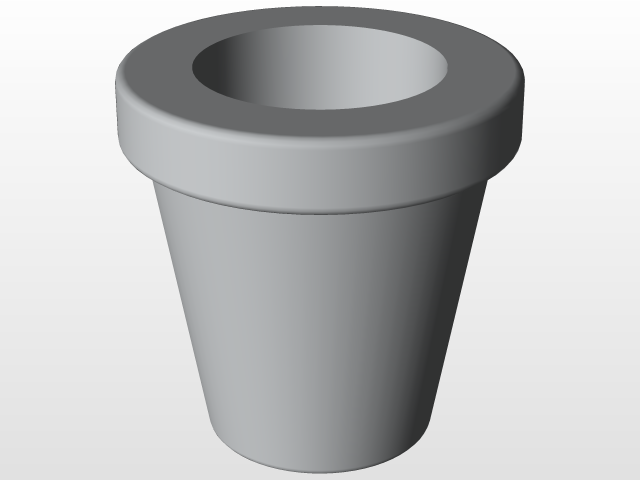
This screenshot has height=480, width=640. Identify the location of vase. (323, 414).